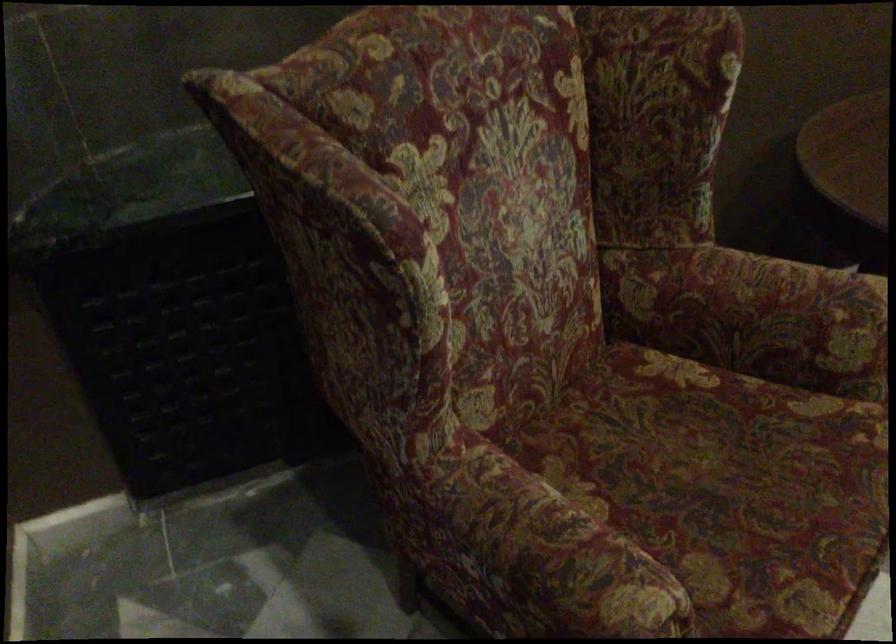
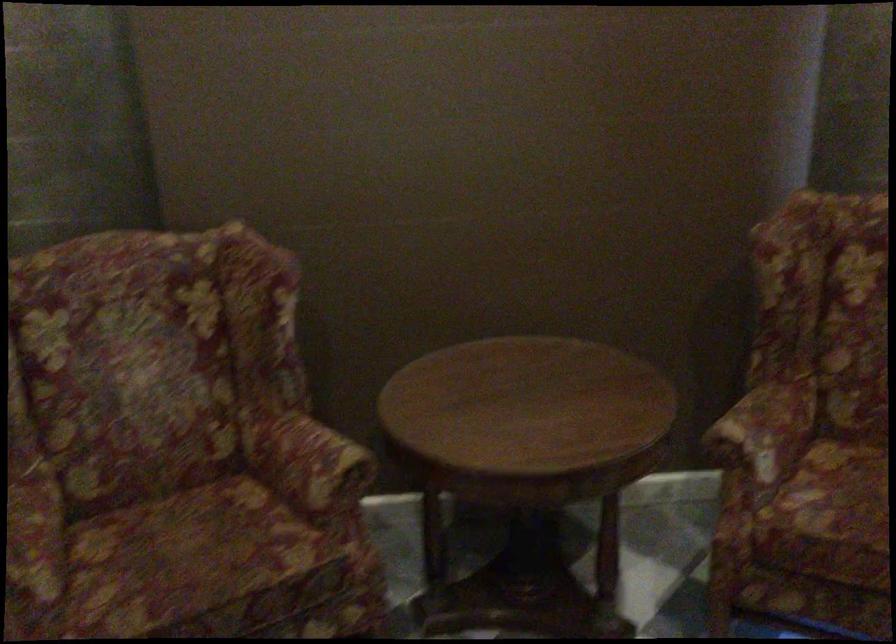
Question: Which direction would the cameraman need to move to produce the second image? Reply with the corresponding letter.

Choices:
 (A) Left
 (B) Right
 (C) Forward
 (D) Backward

Answer: (B)